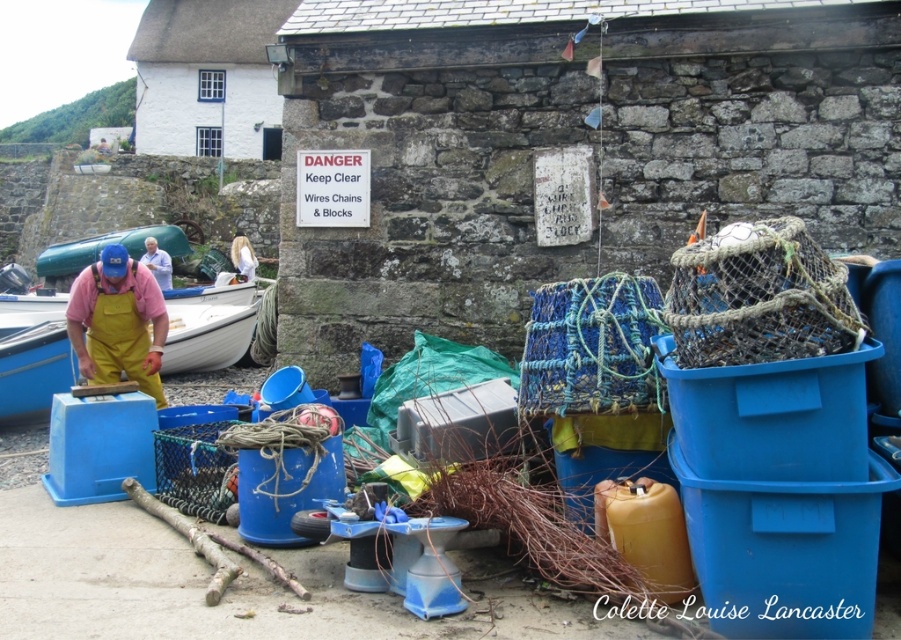
Question: Observing the image, what is the correct spatial positioning of yellow rubber overalls at left in reference to green plastic boat at upper left?

Choices:
 (A) above
 (B) below

Answer: (B)

Question: Which point appears closest to the camera in this image?

Choices:
 (A) (153, 248)
 (B) (235, 241)
 (C) (85, 237)

Answer: (A)

Question: Can you confirm if green plastic boat at upper left is bigger than white fabric shirt at center?

Choices:
 (A) no
 (B) yes

Answer: (B)

Question: Can you confirm if blue fabric at center is smaller than white fabric shirt at center?

Choices:
 (A) no
 (B) yes

Answer: (B)

Question: Among these objects, which one is nearest to the camera?

Choices:
 (A) blue fabric at center
 (B) yellow rubber overalls at left

Answer: (B)

Question: Estimate the real-world distances between objects in this image. Which object is farther from the green plastic boat at upper left?

Choices:
 (A) white fabric shirt at center
 (B) yellow rubber overalls at left
 (C) blue fabric at center

Answer: (B)